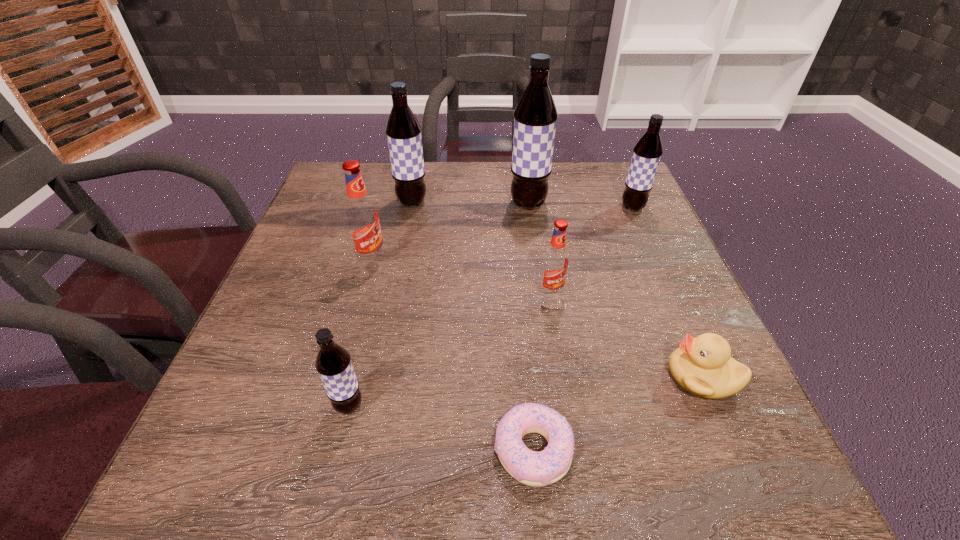
At what (x,y) coordinates should I click in order to perform the action: click on the third brown root beer from left to right. Please return your answer as a coordinate pair (x, y). Image resolution: width=960 pixels, height=540 pixels. Looking at the image, I should click on (535, 117).

At what (x,y) coordinates should I click in order to perform the action: click on the biggest brown root beer. Please return your answer as a coordinate pair (x, y). The height and width of the screenshot is (540, 960). Looking at the image, I should click on (535, 117).

Where is `the second biggest brown root beer`? The image size is (960, 540). the second biggest brown root beer is located at coordinates (403, 130).

The image size is (960, 540). I want to click on the seventh shortest object, so click(x=403, y=130).

Locate an element on the screen. the rightmost brown root beer is located at coordinates (647, 152).

I want to click on the rightmost root beer, so click(x=647, y=152).

I want to click on the fifth nearest object, so click(362, 219).

Locate an element on the screen. The width and height of the screenshot is (960, 540). the farther red root beer is located at coordinates (362, 219).

Identify the location of the smaller red root beer. (555, 260).

Image resolution: width=960 pixels, height=540 pixels. In order to click on the right red root beer in this screenshot , I will do `click(555, 260)`.